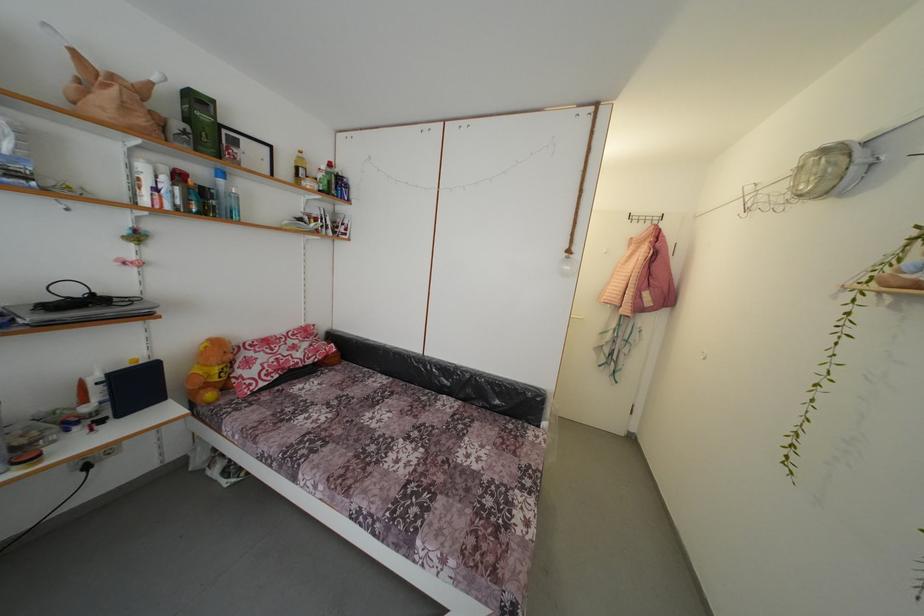
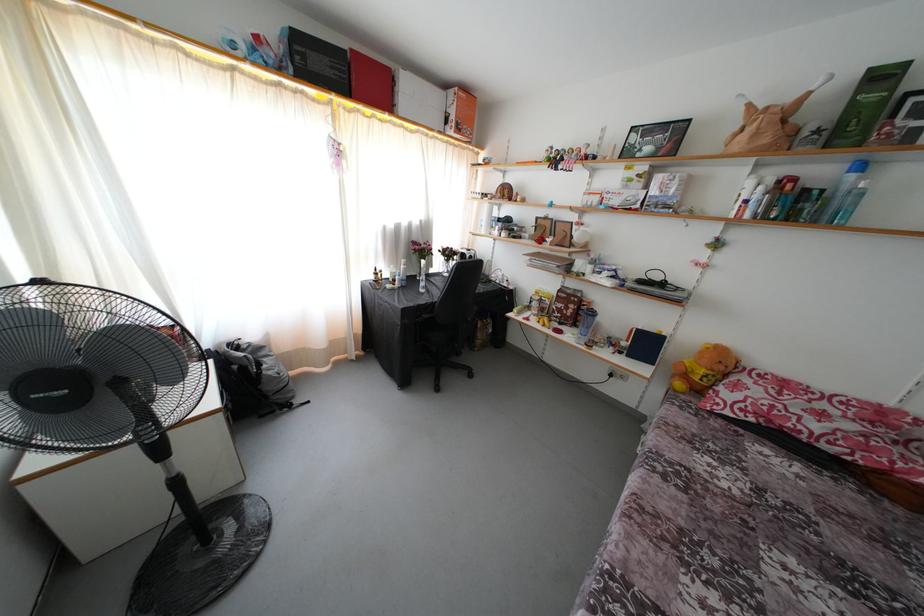
The point at [216,177] is marked in the first image. Where is the corresponding point in the second image?

(849, 172)